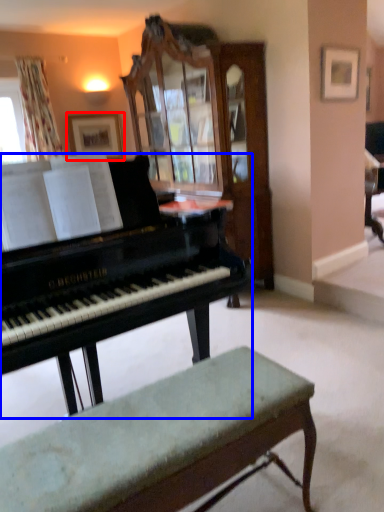
Question: Among these objects, which one is nearest to the camera, picture frame (highlighted by a red box) or piano (highlighted by a blue box)?

Choices:
 (A) picture frame
 (B) piano

Answer: (B)